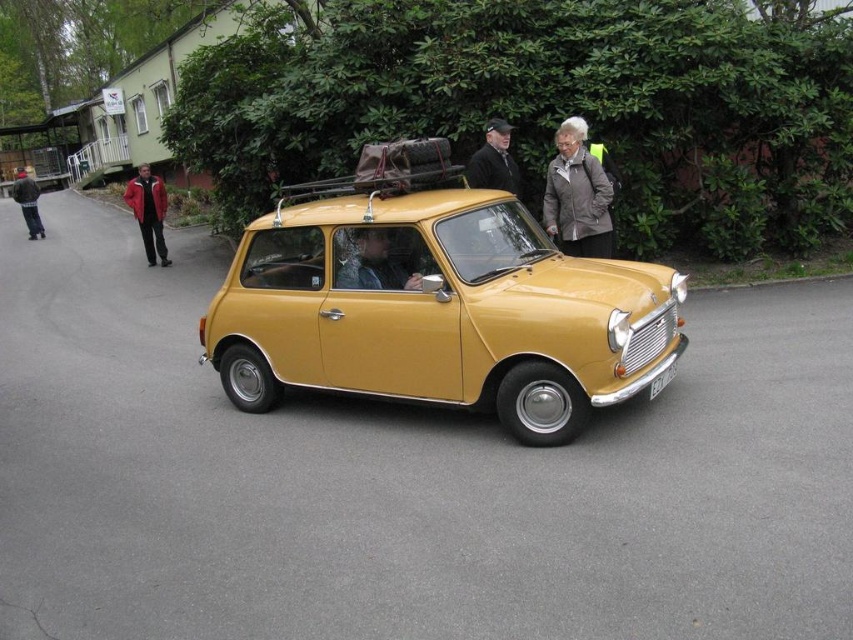
You are a fashion designer observing the vintage yellow Mini Cooper parked on a paved road. You notice two jackets on the luggage rack of the car. Which jacket, the matte gray jacket at center or the matte black jacket at center, is taller?

The matte gray jacket at center is much taller than the matte black jacket at center.

You are a delivery person trying to place a package between the matte gray jacket at center and the matte black jacket at center on the luggage rack. Can you fit the package there?

The matte gray jacket at center might be wider than matte black jacket at center, so there might not be enough space between them to fit the package.